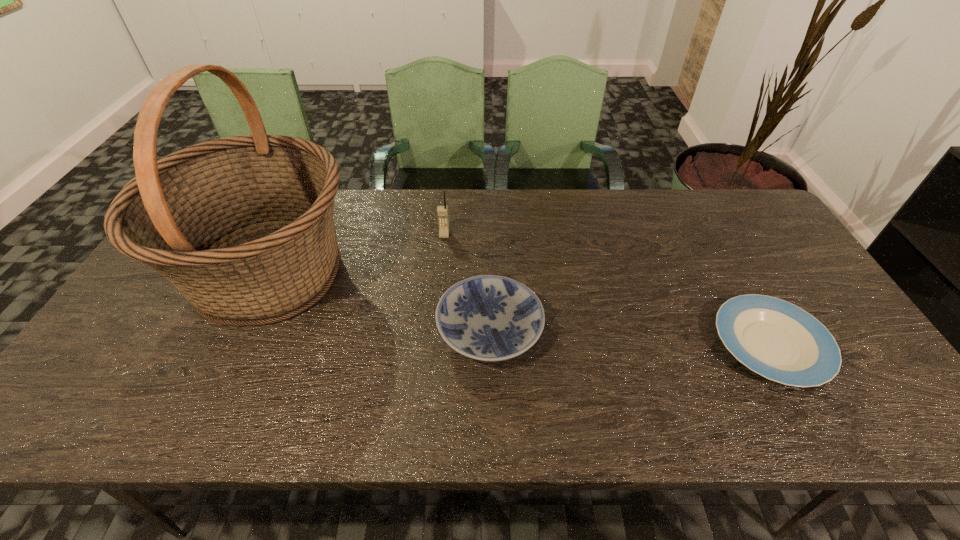
What are the coordinates of `vacant space that satisfies the following two spatial constraints: 1. on the front of the shortest object, where the keypad is located; 2. on the left side of the second tallest object` in the screenshot? It's located at (435, 345).

Where is `vacant space that satisfies the following two spatial constraints: 1. on the front of the taller plate, where the keypad is located; 2. on the right side of the cellular telephone`? vacant space that satisfies the following two spatial constraints: 1. on the front of the taller plate, where the keypad is located; 2. on the right side of the cellular telephone is located at coordinates [436, 330].

Find the location of a particular element. free space that satisfies the following two spatial constraints: 1. on the front of the cellular telephone, where the keypad is located; 2. on the right side of the shorter plate is located at coordinates (435, 345).

Identify the location of free spot that satisfies the following two spatial constraints: 1. on the front of the rightmost object, where the keypad is located; 2. on the right side of the cellular telephone. (435, 345).

The image size is (960, 540). I want to click on blank area in the image that satisfies the following two spatial constraints: 1. on the front of the second tallest object, where the keypad is located; 2. on the right side of the shortest object, so click(435, 345).